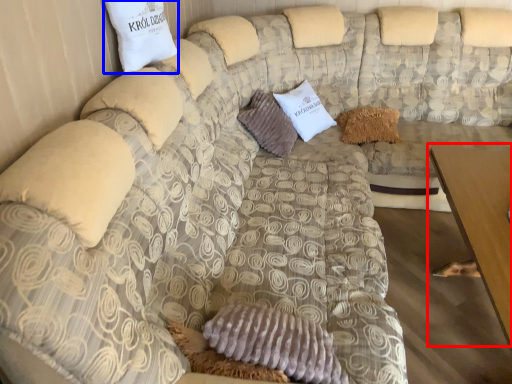
Question: Among these objects, which one is farthest to the camera, table (highlighted by a red box) or pillow (highlighted by a blue box)?

Choices:
 (A) table
 (B) pillow

Answer: (B)